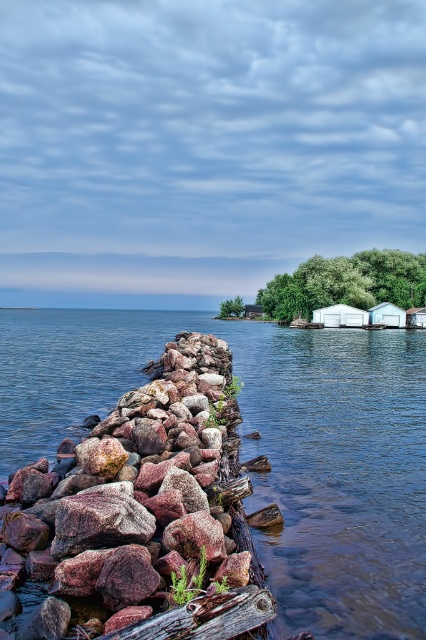
You are standing at the lakeside and want to take a photo of both the green leafy tree at upper center and the wooden cabin at center. Which object should you adjust your camera angle to include first if you need to frame them both in the shot?

The green leafy tree at upper center is located above the wooden cabin at center, so you should adjust your camera angle to include the green leafy tree at upper center first by angling the camera upward to capture both objects in the frame.

You are standing on the rocky shoreline and want to reach the wooden cabin at center without getting your feet wet. Which direction should you walk to avoid the clear water at center?

You should walk to the left of the wooden cabin at center because the clear water at center is to the right of it, so moving left would keep you on dry land.

You are standing on the rocky shore and want to get to the wooden cabin at center without getting your feet wet. Is there a dry path around the clear water at center?

The clear water at center is positioned under wooden cabin at center, so you can walk directly to the wooden cabin at center without needing to go around the water since it is located beneath the cabin.